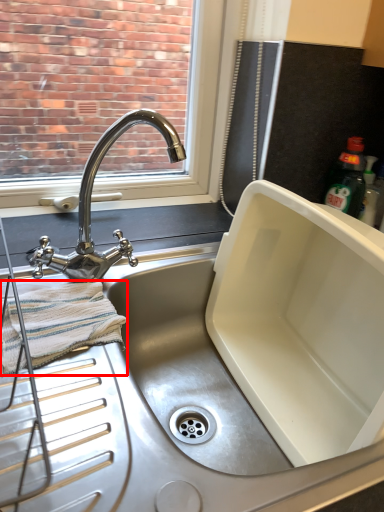
Question: From the image's perspective, where is bath towel (annotated by the red box) located relative to tap?

Choices:
 (A) below
 (B) above

Answer: (A)